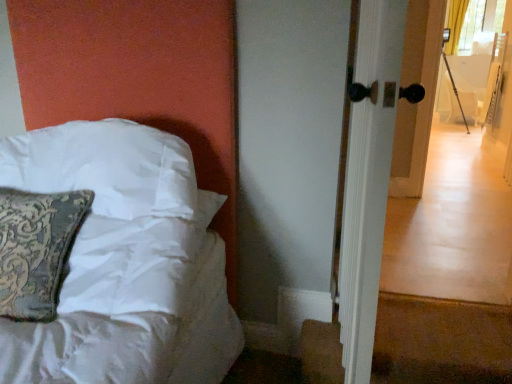
Describe the element at coordinates (470, 82) in the screenshot. The height and width of the screenshot is (384, 512). I see `white fabric armchair at right` at that location.

At what (x,y) coordinates should I click in order to perform the action: click on white glossy door handle at right. Please return your answer as a coordinate pair (x, y). Looking at the image, I should click on (368, 182).

What are the coordinates of `white fabric armchair at right` in the screenshot? It's located at (470, 82).

Considering the relative sizes of white satin pillow at left and white glossy door handle at right in the image provided, is white satin pillow at left smaller than white glossy door handle at right?

Correct, white satin pillow at left occupies less space than white glossy door handle at right.

Is white satin pillow at left looking in the opposite direction of white glossy door handle at right?

No, white satin pillow at left is not facing away from white glossy door handle at right.

Is the position of white satin pillow at left less distant than that of white glossy door handle at right?

No, white satin pillow at left is behind white glossy door handle at right.

From a real-world perspective, is white satin pillow at left physically located above or below white glossy door handle at right?

From a real-world perspective, white satin pillow at left is physically below white glossy door handle at right.

Is white satin pillow at left turned away from white fabric armchair at right?

Absolutely, white satin pillow at left is directed away from white fabric armchair at right.

Find the location of a particular element. bed above the white fabric armchair at right (from a real-world perspective) is located at coordinates (125, 263).

Can you tell me how much white satin pillow at left and white fabric armchair at right differ in facing direction?

white satin pillow at left and white fabric armchair at right are facing 90.7 degrees away from each other.

Between white satin pillow at left and white fabric armchair at right, which one has less height?

Standing shorter between the two is white satin pillow at left.

Is white glossy door handle at right to the left of white satin pillow at left from the viewer's perspective?

No, white glossy door handle at right is not to the left of white satin pillow at left.

Is white glossy door handle at right not close to white satin pillow at left?

No, there isn't a large distance between white glossy door handle at right and white satin pillow at left.

Is white glossy door handle at right in front of or behind white satin pillow at left in the image?

Clearly, white glossy door handle at right is in front of white satin pillow at left.

Is white glossy door handle at right looking in the opposite direction of white satin pillow at left?

white glossy door handle at right is not turned away from white satin pillow at left.

From the image's perspective, between white glossy door handle at right and white fabric armchair at right, who is located below?

From the image's view, white glossy door handle at right is below.

Based on their sizes in the image, would you say white glossy door handle at right is bigger or smaller than white fabric armchair at right?

Considering their sizes, white glossy door handle at right takes up less space than white fabric armchair at right.

Is the depth of white glossy door handle at right greater than that of white fabric armchair at right?

No, it is not.

From a real-world perspective, is white glossy door handle at right physically located above or below white fabric armchair at right?

white glossy door handle at right is situated higher than white fabric armchair at right in the real world.

Between white fabric armchair at right and white satin pillow at left, which one appears on the right side from the viewer's perspective?

From the viewer's perspective, white fabric armchair at right appears more on the right side.

Is the depth of white fabric armchair at right greater than that of white satin pillow at left?

Yes, white fabric armchair at right is behind white satin pillow at left.

How many degrees apart are the facing directions of white fabric armchair at right and white satin pillow at left?

The angular difference between white fabric armchair at right and white satin pillow at left is 90.7 degrees.

Does white fabric armchair at right touch white satin pillow at left?

white fabric armchair at right and white satin pillow at left are not in contact.

Does white fabric armchair at right have a lesser height compared to white glossy door handle at right?

Correct, white fabric armchair at right is not as tall as white glossy door handle at right.

Is white fabric armchair at right spatially inside white glossy door handle at right, or outside of it?

The correct answer is: outside.

Based on the photo, is the surface of white fabric armchair at right in direct contact with white glossy door handle at right?

They are not placed beside each other.

From the image's perspective, is white fabric armchair at right under white glossy door handle at right?

Incorrect, from the image's perspective, white fabric armchair at right is higher than white glossy door handle at right.

Image resolution: width=512 pixels, height=384 pixels. Identify the location of screen door on the right of white satin pillow at left. (368, 182).

Find the location of a particular element. armchair lying above the white satin pillow at left (from the image's perspective) is located at coordinates (470, 82).

Estimate the real-world distances between objects in this image. Which object is closer to white satin pillow at left, white fabric armchair at right or white glossy door handle at right?

Among the two, white glossy door handle at right is located nearer to white satin pillow at left.

Estimate the real-world distances between objects in this image. Which object is further from white fabric armchair at right, white glossy door handle at right or white satin pillow at left?

The object further to white fabric armchair at right is white satin pillow at left.

Looking at the image, which one is located closer to white satin pillow at left, white glossy door handle at right or white fabric armchair at right?

The object closer to white satin pillow at left is white glossy door handle at right.

When comparing their distances from white fabric armchair at right, does white satin pillow at left or white glossy door handle at right seem closer?

white glossy door handle at right is positioned closer to the anchor white fabric armchair at right.

From the image, which object appears to be nearer to white glossy door handle at right, white fabric armchair at right or white satin pillow at left?

white satin pillow at left.

Based on their spatial positions, is white satin pillow at left or white fabric armchair at right further from white glossy door handle at right?

The object further to white glossy door handle at right is white fabric armchair at right.

The width and height of the screenshot is (512, 384). Identify the location of bed between white glossy door handle at right and white fabric armchair at right from front to back. (125, 263).